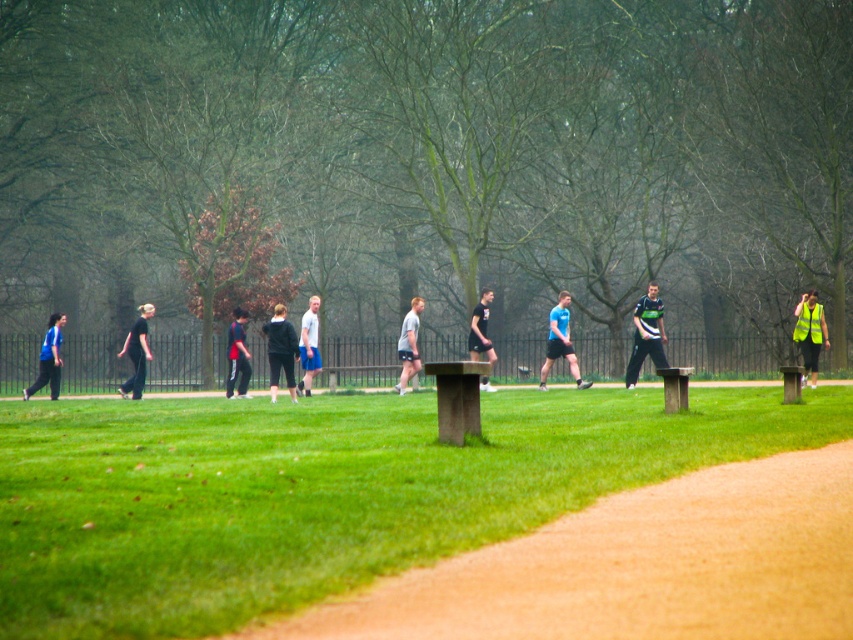
What is located at the point with coordinates (560, 342) in the park scene?

The blue fabric shirt at center is located at the point with coordinates (560, 342) in the park scene.

You are a photographer standing at the edge of the dirt path in the park. You want to take a photo that includes both the black matte jacket at center and the dark blue jacket at center. If your camera has a maximum focus range of 3 meters, will you be able to capture both subjects in focus without moving closer?

The black matte jacket at center is 3.30 meters from the dark blue jacket at center. Since the distance between them exceeds the camera lens focus range of 3 meters, you will not be able to capture both subjects in focus simultaneously without adjusting your position or equipment.